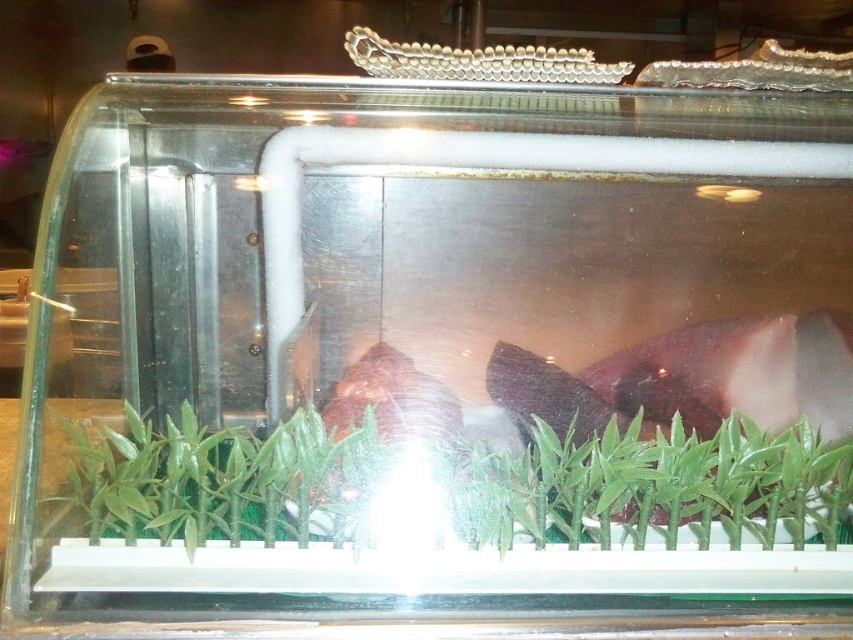
Is green matte bamboo at lower center bigger than green matte plant at center?

Yes.

Between green matte bamboo at lower center and green matte plant at center, which one has more height?

green matte plant at center

Which is behind, point (680, 516) or point (207, 504)?

Point (680, 516)

The width and height of the screenshot is (853, 640). What are the coordinates of `green matte bamboo at lower center` in the screenshot? It's located at (653, 483).